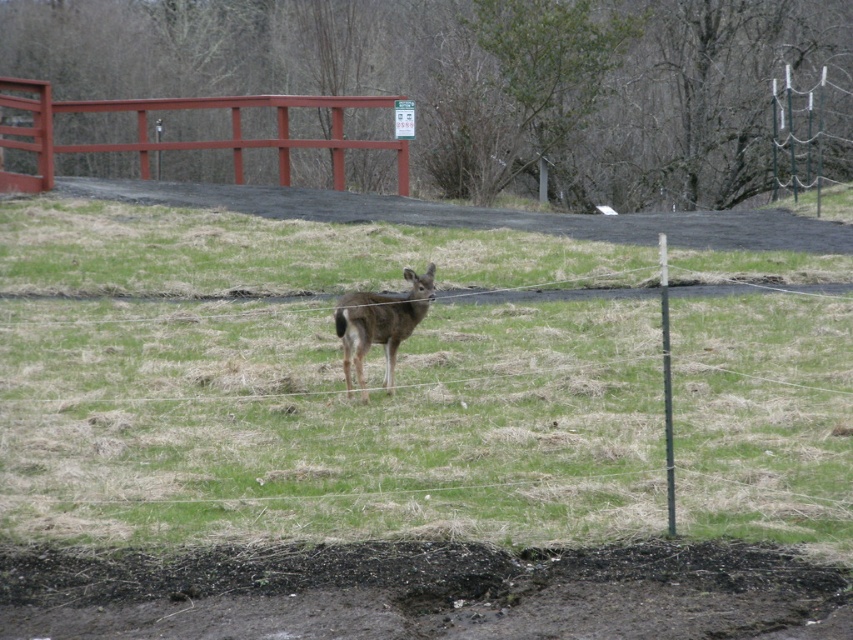
Which is more to the right, green grassy at center or smooth wooden fence at upper center?

Positioned to the right is green grassy at center.

Does green grassy at center have a greater width compared to smooth wooden fence at upper center?

Yes.

This screenshot has height=640, width=853. Find the location of `green grassy at center`. green grassy at center is located at coordinates (317, 385).

The height and width of the screenshot is (640, 853). What do you see at coordinates (317, 385) in the screenshot? I see `green grassy at center` at bounding box center [317, 385].

Is green grassy at center above brown matte deer at center?

Yes.

Between point (76, 481) and point (354, 314), which one is positioned in front?

Point (76, 481) is more forward.

The height and width of the screenshot is (640, 853). I want to click on green grassy at center, so click(x=317, y=385).

Is smooth wooden fence at upper center taller than brown matte deer at center?

Correct, smooth wooden fence at upper center is much taller as brown matte deer at center.

Measure the distance from smooth wooden fence at upper center to brown matte deer at center.

smooth wooden fence at upper center and brown matte deer at center are 37.12 feet apart.

Which is in front, point (288, 172) or point (381, 328)?

Positioned in front is point (381, 328).

This screenshot has width=853, height=640. I want to click on smooth wooden fence at upper center, so click(x=184, y=141).